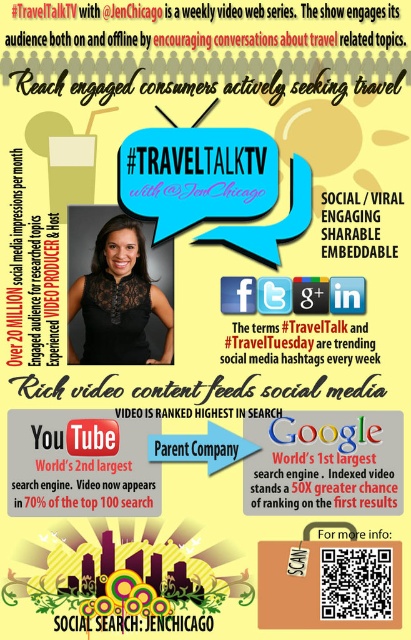
You are designing a poster for a travel blog and want to include both the whitetextured papersign at upper right and the black text at center. Which object should you place higher up on the poster to maintain visual hierarchy?

The whitetextured papersign at upper right should be placed higher up on the poster since it is much taller than the black text at center, allowing it to dominate the visual hierarchy.